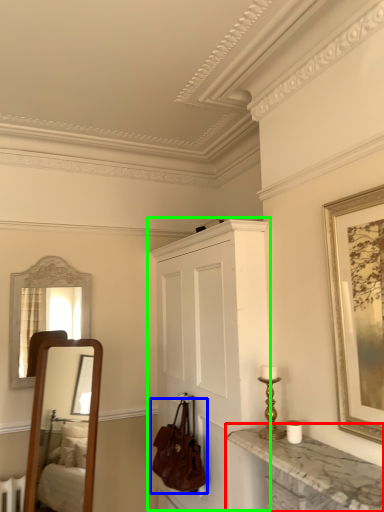
Question: Estimate the real-world distances between objects in this image. Which object is farther from countertop (highlighted by a red box), handbag (highlighted by a blue box) or cabinetry (highlighted by a green box)?

Choices:
 (A) handbag
 (B) cabinetry

Answer: (A)